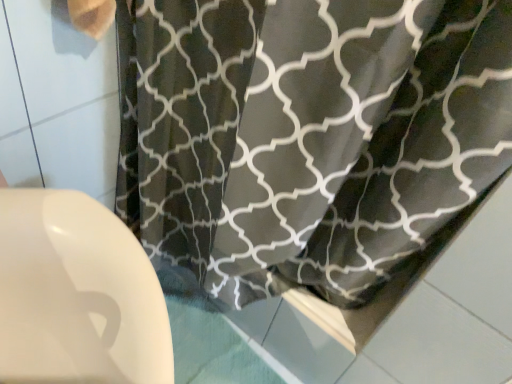
Find the location of a particular element. The width and height of the screenshot is (512, 384). white glossy sink at lower left is located at coordinates pos(77,294).

What do you see at coordinates (77, 294) in the screenshot? This screenshot has height=384, width=512. I see `white glossy sink at lower left` at bounding box center [77, 294].

Measure the distance between white glossy sink at lower left and camera.

The depth of white glossy sink at lower left is 21.02 inches.

Where is `white glossy sink at lower left`? The height and width of the screenshot is (384, 512). white glossy sink at lower left is located at coordinates (77, 294).